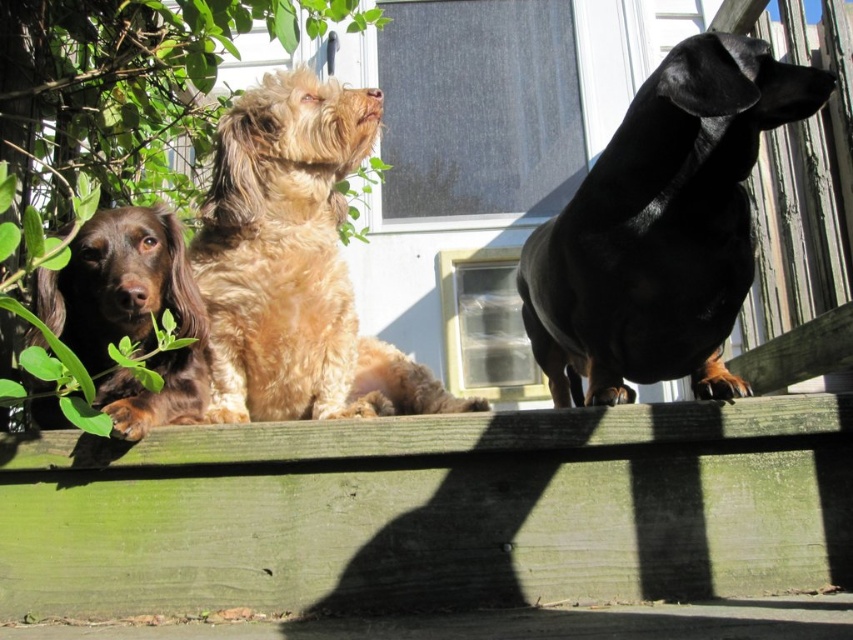
Does green wood at center lie in front of black shiny dachshund at upper right?

No, it is not.

Who is positioned more to the left, green wood at center or black shiny dachshund at upper right?

From the viewer's perspective, green wood at center appears more on the left side.

Where is `green wood at center`? green wood at center is located at coordinates (432, 509).

Can you confirm if black shiny dachshund at upper right is thinner than fuzzy brown dog at center?

Yes.

Is black shiny dachshund at upper right shorter than fuzzy brown dog at center?

Incorrect, black shiny dachshund at upper right's height does not fall short of fuzzy brown dog at center's.

Does point (706, 60) lie behind point (289, 209)?

No, it is not.

This screenshot has width=853, height=640. What are the coordinates of `black shiny dachshund at upper right` in the screenshot? It's located at (662, 227).

Does green wood at center appear under brown furry dog at left?

Yes, green wood at center is below brown furry dog at left.

Is green wood at center closer to camera compared to brown furry dog at left?

No.

The image size is (853, 640). I want to click on green wood at center, so click(432, 509).